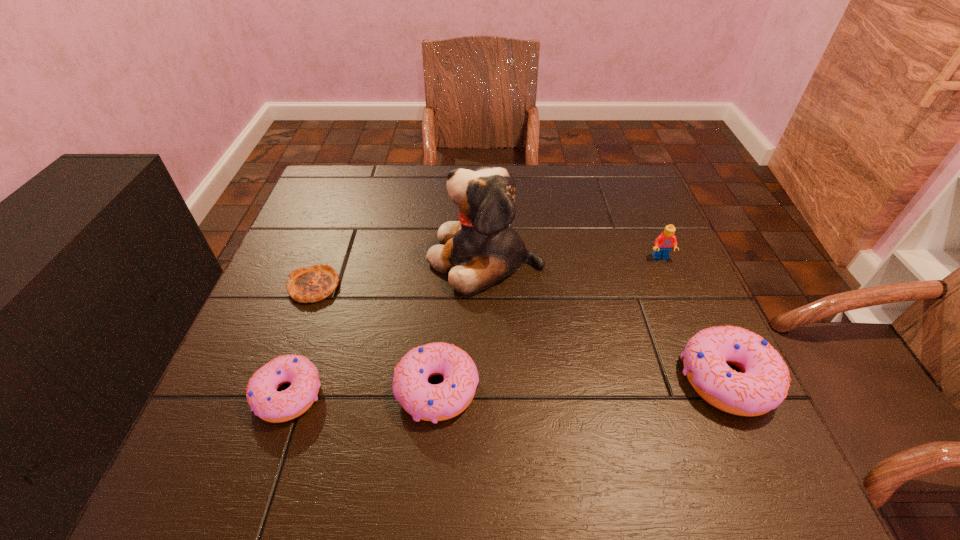
You are a GUI agent. You are given a task and a screenshot of the screen. Output one action in this format:
    pyautogui.click(x=<x>, y=<y>)
    Task: Click on the object that is at the near left corner
    
    Given the screenshot: What is the action you would take?
    pyautogui.click(x=263, y=398)

You are a GUI agent. You are given a task and a screenshot of the screen. Output one action in this format:
    pyautogui.click(x=<x>, y=<y>)
    Task: Click on the object positioned at the near right corner
    The image size is (960, 540).
    Given the screenshot: What is the action you would take?
    pyautogui.click(x=762, y=386)

Find the location of a particular element. The width and height of the screenshot is (960, 540). free space at the far edge is located at coordinates (590, 199).

Image resolution: width=960 pixels, height=540 pixels. Identify the location of vacant space at the near edge of the desktop. (341, 387).

Find the location of a particular element. blank area at the left edge is located at coordinates (300, 254).

In the image, there is a desktop. Where is `blank space at the right edge`? blank space at the right edge is located at coordinates (634, 299).

Identify the location of free spot at the far left corner of the desktop. The width and height of the screenshot is (960, 540). (337, 165).

In order to click on empty space between the rightmost doughnut and the second shortest doughnut in this screenshot , I will do `click(582, 384)`.

This screenshot has height=540, width=960. In order to click on blank region between the puppy and the shortest doughnut in this screenshot , I will do `click(387, 326)`.

I want to click on vacant region between the rightmost doughnut and the second doughnut from right to left, so click(582, 384).